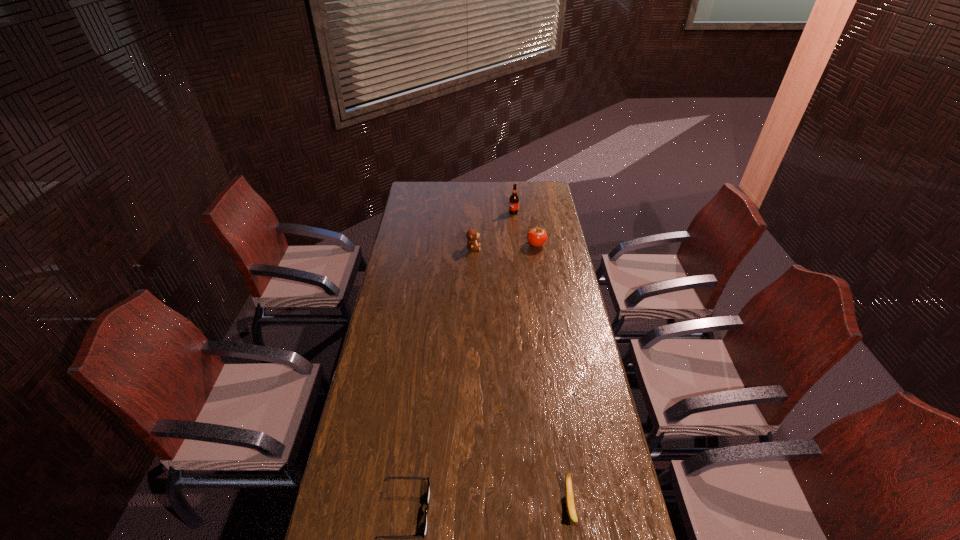
Locate an element on the screen. This screenshot has height=540, width=960. free point at the far edge is located at coordinates (488, 195).

At what (x,y) coordinates should I click in order to perform the action: click on vacant space at the left edge of the desktop. Please return your answer as a coordinate pair (x, y). The image size is (960, 540). Looking at the image, I should click on click(390, 377).

Identify the location of vacant space at the right edge of the desktop. Image resolution: width=960 pixels, height=540 pixels. (568, 399).

Locate an element on the screen. free space between the second shortest object and the teddy bear is located at coordinates (521, 378).

Locate an element on the screen. The height and width of the screenshot is (540, 960). free space between the farthest object and the fourth tallest object is located at coordinates (541, 360).

At what (x,y) coordinates should I click in order to perform the action: click on free point between the third object from left to right and the second shortest object. Please return your answer as a coordinate pair (x, y). The image size is (960, 540). Looking at the image, I should click on (541, 360).

What are the coordinates of `vacant region between the fourth tallest object and the farthest object` in the screenshot? It's located at (541, 360).

Locate an element on the screen. free space between the fourth object from right to left and the third object from left to right is located at coordinates (493, 230).

This screenshot has height=540, width=960. I want to click on unoccupied area between the teddy bear and the farthest object, so point(493,230).

Find the location of `free space between the teddy bear and the banana`. free space between the teddy bear and the banana is located at coordinates (521, 378).